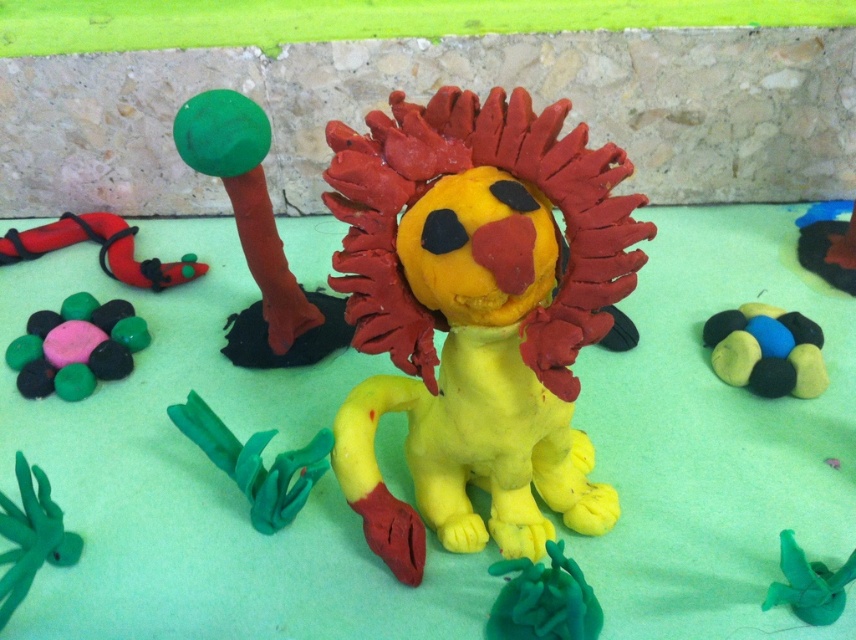
Question: Is the position of yellow clay lion at center less distant than that of matte clay rocks at center?

Choices:
 (A) no
 (B) yes

Answer: (B)

Question: Which point is closer to the camera?

Choices:
 (A) (545, 621)
 (B) (815, 579)
 (C) (195, 168)

Answer: (A)

Question: Which point is closer to the camera?

Choices:
 (A) yellow clay lion at center
 (B) matte green plant at lower center

Answer: (A)

Question: Observing the image, what is the correct spatial positioning of yellow clay lion at center in reference to matte clay rocks at center?

Choices:
 (A) above
 (B) below

Answer: (A)

Question: Does smooth clay pebbles at lower left appear under green clay plant at lower left?

Choices:
 (A) yes
 (B) no

Answer: (B)

Question: Which object is the closest to the smooth clay pebbles at lower left?

Choices:
 (A) matte green plant at lower left
 (B) green matte ball at upper left

Answer: (B)